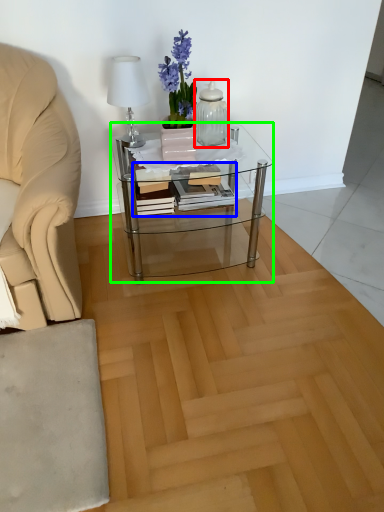
Question: Considering the real-world distances, which object is closest to glass vase (highlighted by a red box)? book (highlighted by a blue box) or coffee table (highlighted by a green box).

Choices:
 (A) book
 (B) coffee table

Answer: (A)